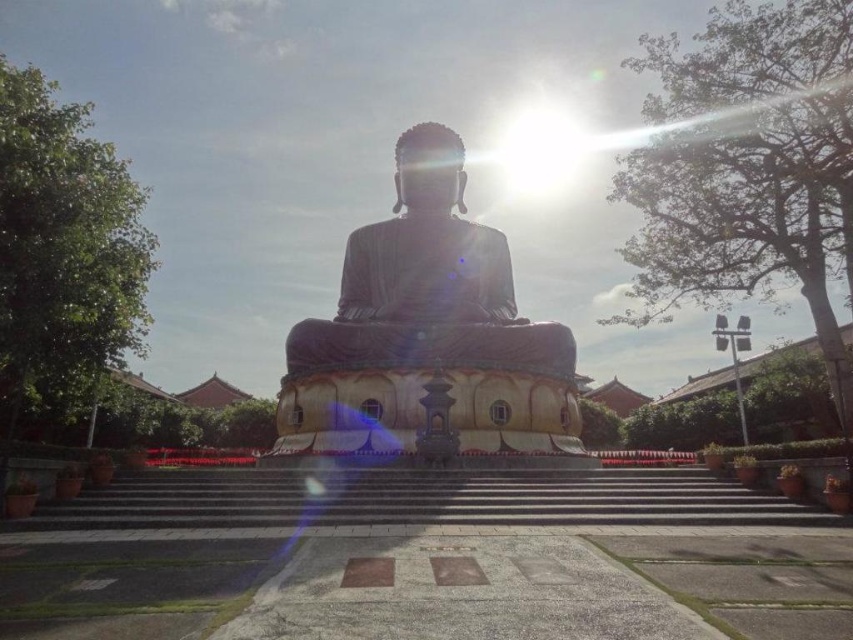
You are a tour guide explaining the layout of the Buddha statue area to visitors. You mention the dark gray concrete stairs at center and the satin gold statue at center. Which one is taller?

The satin gold statue at center is taller than the dark gray concrete stairs at center.

You are a tour guide explaining the statue to visitors. You want to mention the distance between the two parts of the statue. How far apart are the black polished stone statue at center and the satin gold statue at center?

The distance between the black polished stone statue at center and the satin gold statue at center is 1.46 meters.

You are standing at the base of the dark gray concrete stairs at center and want to reach the satin gold statue at center. Which direction should you move to get closer to the statue?

The dark gray concrete stairs at center are to the right of the satin gold statue at center. To reach the statue, you should move to your left.